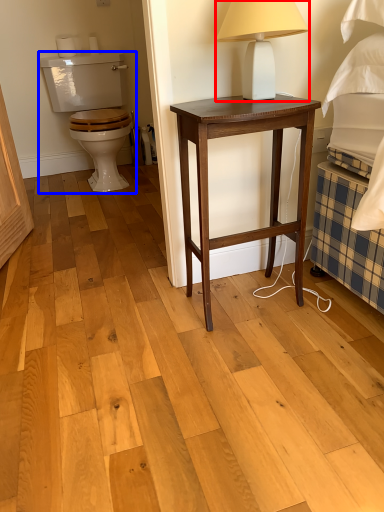
Question: Which point is closer to the camera, table lamp (highlighted by a red box) or armchair (highlighted by a blue box)?

Choices:
 (A) table lamp
 (B) armchair

Answer: (A)